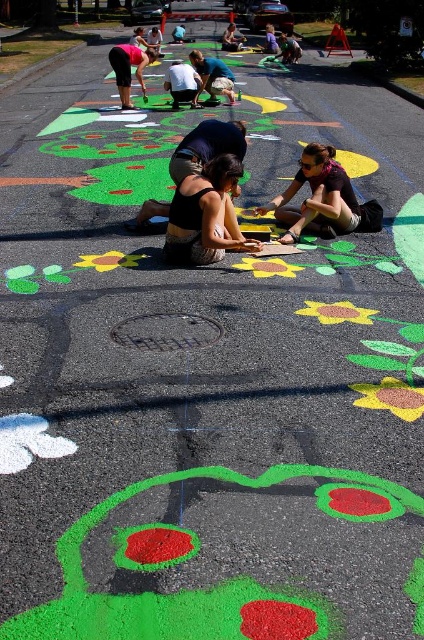
Is matte black tank top at center behind matte black shirt at center?

No, it is not.

The image size is (424, 640). What do you see at coordinates (206, 216) in the screenshot? I see `matte black tank top at center` at bounding box center [206, 216].

Does point (220, 253) come in front of point (329, 164)?

Yes, it is.

This screenshot has height=640, width=424. In order to click on matte black tank top at center in this screenshot , I will do `click(206, 216)`.

Is point (219, 160) closer to camera compared to point (136, 76)?

Yes, it is in front of point (136, 76).

Is matte black tank top at center taller than matte black shorts at upper left?

Incorrect, matte black tank top at center's height is not larger of matte black shorts at upper left's.

Based on the photo, who is more forward, [200,198] or [123,49]?

Positioned in front is point [200,198].

This screenshot has width=424, height=640. I want to click on matte black tank top at center, so click(206, 216).

Who is positioned more to the left, matte black shirt at center or matte black shorts at upper left?

matte black shorts at upper left is more to the left.

Which is behind, point (303, 154) or point (117, 68)?

The point (117, 68) is more distant.

Locate an element on the screen. matte black shirt at center is located at coordinates (323, 198).